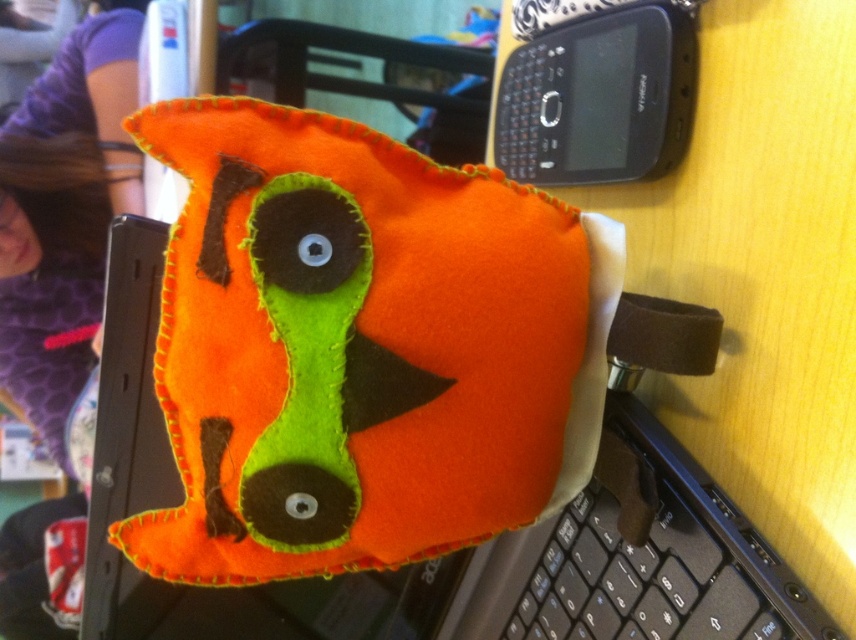
You are a delivery robot with a box that is 12 inches long. You need to place the box between the orange felt plush toy at center and the black plastic keyboard at lower right. Is there enough space to fit the box horizontally between them?

The orange felt plush toy at center and the black plastic keyboard at lower right are 11.43 inches apart, so the 12 inch box is slightly longer than the available space between them. Therefore, the box cannot be placed horizontally between them.